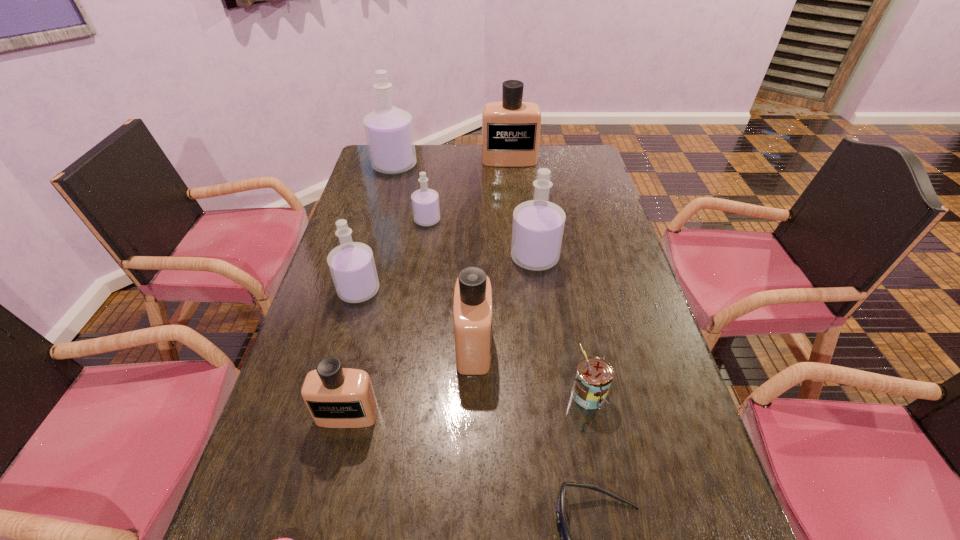
Select which object is the third closest to the third smallest purple perfume. Please provide its 2D coordinates. Your answer should be formatted as a tuple, i.e. [(x, y)], where the tuple contains the x and y coordinates of a point satisfying the conditions above.

[(594, 375)]

Identify which object is the fourth closest to the blue sunglasses. Please provide its 2D coordinates. Your answer should be formatted as a tuple, i.e. [(x, y)], where the tuple contains the x and y coordinates of a point satisfying the conditions above.

[(282, 539)]

Select which perfume is the fifth closest to the farthest beige perfume. Please provide its 2D coordinates. Your answer should be formatted as a tuple, i.e. [(x, y)], where the tuple contains the x and y coordinates of a point satisfying the conditions above.

[(472, 308)]

Locate an element on the screen. perfume that is the closest to the smallest purple perfume is located at coordinates (389, 132).

Choose which purple perfume is the second nearest neighbor to the biggest beige perfume. Please provide its 2D coordinates. Your answer should be formatted as a tuple, i.e. [(x, y)], where the tuple contains the x and y coordinates of a point satisfying the conditions above.

[(425, 202)]

You are a GUI agent. You are given a task and a screenshot of the screen. Output one action in this format:
    pyautogui.click(x=<x>, y=<y>)
    Task: Click on the purple perfume that stands as the second closest to the fifth nearest perfume
    The image size is (960, 540).
    Given the screenshot: What is the action you would take?
    pyautogui.click(x=352, y=266)

Where is `the third closest beige perfume to the nearest purple perfume`? The width and height of the screenshot is (960, 540). the third closest beige perfume to the nearest purple perfume is located at coordinates (510, 128).

Locate which beige perfume ranks second in proximity to the seventh nearest object. Please provide its 2D coordinates. Your answer should be formatted as a tuple, i.e. [(x, y)], where the tuple contains the x and y coordinates of a point satisfying the conditions above.

[(510, 128)]

Find the location of a particular element. The width and height of the screenshot is (960, 540). free region that satisfies the following two spatial constraints: 1. on the front side of the third farthest perfume; 2. on the right side of the third shortest object is located at coordinates (402, 393).

I want to click on vacant area that satisfies the following two spatial constraints: 1. on the front label of the second farthest beige perfume; 2. on the back side of the eighth tallest object, so click(473, 393).